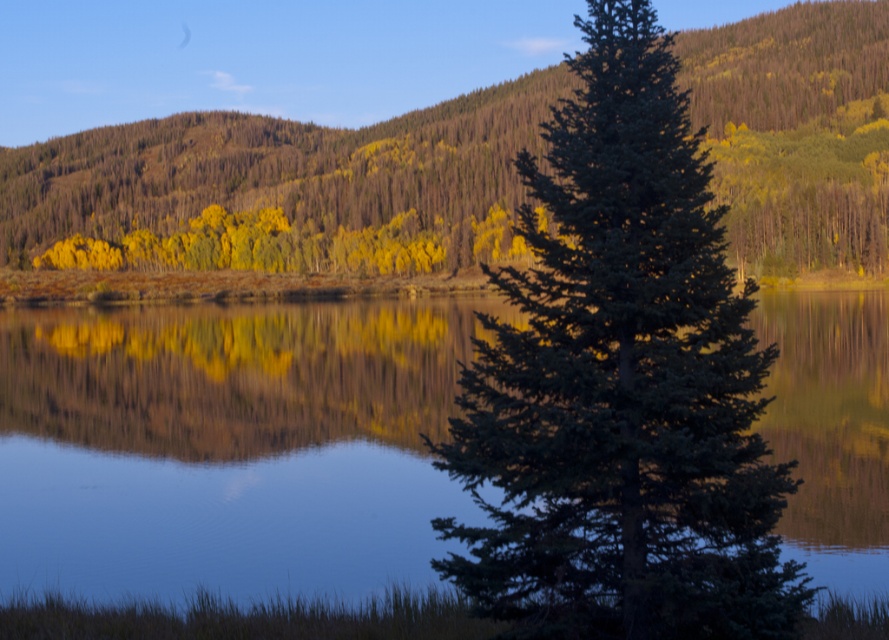
Question: Is green matte tree at center to the left of yellow-green foliage at upper center from the viewer's perspective?

Choices:
 (A) no
 (B) yes

Answer: (A)

Question: Among these objects, which one is farthest from the camera?

Choices:
 (A) yellow-green foliage at upper center
 (B) green matte tree at center

Answer: (A)

Question: Is transparent water at center in front of yellow-green foliage at upper center?

Choices:
 (A) no
 (B) yes

Answer: (B)

Question: Which object is closer to the camera taking this photo?

Choices:
 (A) transparent water at center
 (B) yellow-green foliage at upper center

Answer: (A)

Question: Which point appears closest to the camera in this image?

Choices:
 (A) (605, 193)
 (B) (807, 460)
 (C) (433, 193)

Answer: (A)

Question: Is green matte tree at center to the right of yellow-green foliage at upper center from the viewer's perspective?

Choices:
 (A) no
 (B) yes

Answer: (B)